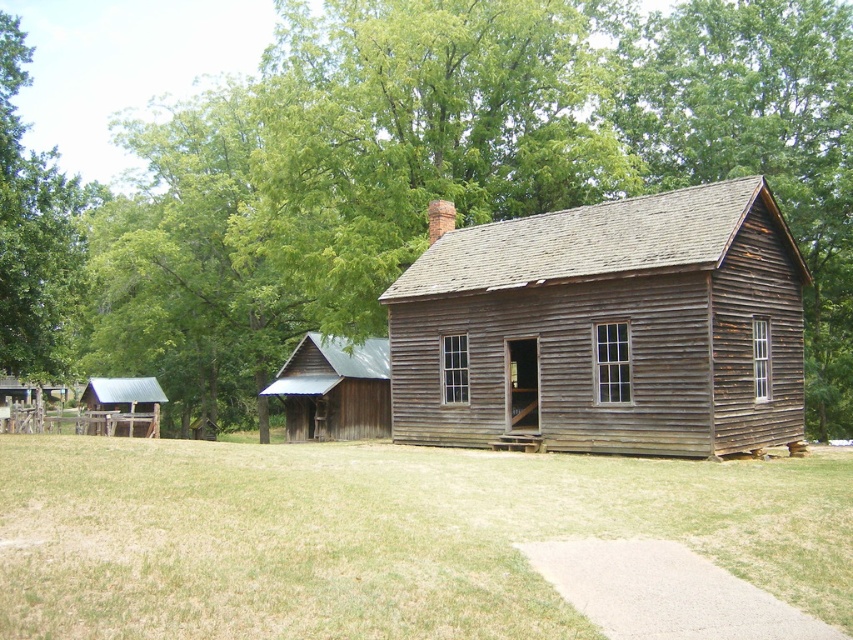
You are standing in front of the rustic wooden cabin and notice two green leafy trees in the background. Which tree, the green leafy tree at upper center or the green leafy tree at upper left, appears taller?

The green leafy tree at upper center is much taller than the green leafy tree at upper left.